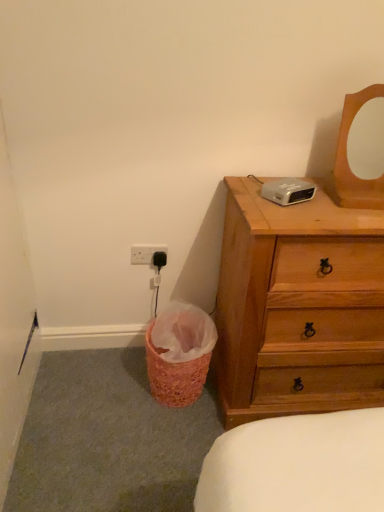
Question: From a real-world perspective, is white plastic electric outlet at lower left below pink woven basket at lower left?

Choices:
 (A) yes
 (B) no

Answer: (B)

Question: Can you confirm if white plastic electric outlet at lower left is taller than pink woven basket at lower left?

Choices:
 (A) yes
 (B) no

Answer: (B)

Question: Is white plastic electric outlet at lower left directly adjacent to pink woven basket at lower left?

Choices:
 (A) no
 (B) yes

Answer: (A)

Question: Is white plastic electric outlet at lower left smaller than pink woven basket at lower left?

Choices:
 (A) no
 (B) yes

Answer: (B)

Question: Can you confirm if white plastic electric outlet at lower left is positioned to the left of pink woven basket at lower left?

Choices:
 (A) no
 (B) yes

Answer: (B)

Question: Are white plastic electric outlet at lower left and pink woven basket at lower left located far from each other?

Choices:
 (A) no
 (B) yes

Answer: (A)

Question: Is white plastic electric outlet at lower left not near wooden mirror at upper right?

Choices:
 (A) yes
 (B) no

Answer: (B)

Question: Is white plastic electric outlet at lower left smaller than wooden mirror at upper right?

Choices:
 (A) yes
 (B) no

Answer: (A)

Question: Could wooden mirror at upper right be considered to be inside white plastic electric outlet at lower left?

Choices:
 (A) no
 (B) yes

Answer: (A)

Question: From a real-world perspective, is white plastic electric outlet at lower left located beneath wooden mirror at upper right?

Choices:
 (A) no
 (B) yes

Answer: (B)

Question: Can you confirm if white plastic electric outlet at lower left is shorter than wooden mirror at upper right?

Choices:
 (A) yes
 (B) no

Answer: (A)

Question: Considering the relative positions of white plastic electric outlet at lower left and wooden mirror at upper right in the image provided, is white plastic electric outlet at lower left to the right of wooden mirror at upper right from the viewer's perspective?

Choices:
 (A) no
 (B) yes

Answer: (A)

Question: Is pink woven basket at lower left to the left of wooden mirror at upper right from the viewer's perspective?

Choices:
 (A) no
 (B) yes

Answer: (B)